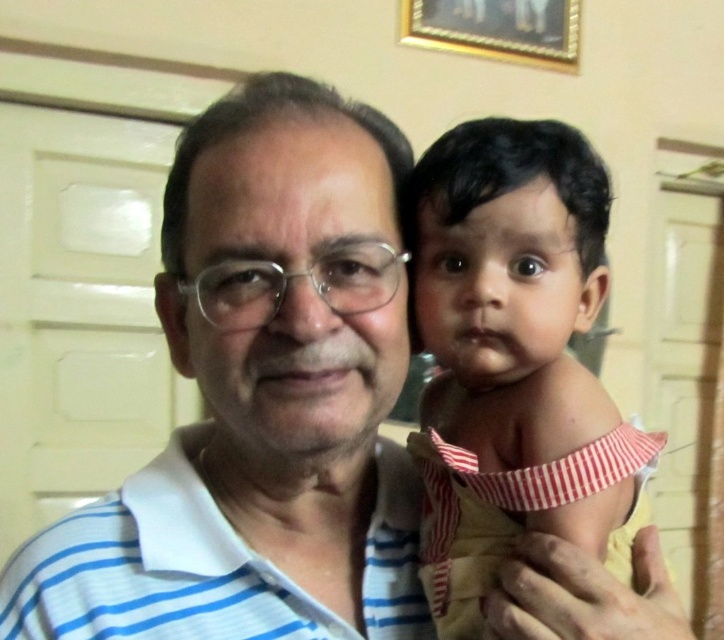
Does white striped polo shirt at center have a smaller size compared to gold-framed picture at upper center?

Incorrect, white striped polo shirt at center is not smaller in size than gold-framed picture at upper center.

Does white striped polo shirt at center lie behind gold-framed picture at upper center?

That is False.

This screenshot has width=724, height=640. I want to click on white striped polo shirt at center, so pyautogui.click(x=260, y=400).

Where is `white striped polo shirt at center`? white striped polo shirt at center is located at coordinates (260, 400).

Is soft beige cloth at right behind gold-framed picture at upper center?

That is False.

Locate an element on the screen. soft beige cloth at right is located at coordinates (513, 355).

In the scene shown: Which of these two, white striped polo shirt at center or soft beige cloth at right, stands taller?

white striped polo shirt at center is taller.

Which is behind, point (371, 349) or point (544, 364)?

Positioned behind is point (544, 364).

Is point (286, 106) behind point (544, 131)?

No, it is not.

Where is `white striped polo shirt at center`? This screenshot has width=724, height=640. white striped polo shirt at center is located at coordinates (260, 400).